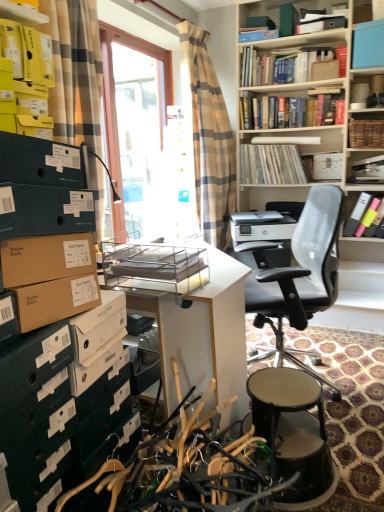
Question: From the image's perspective, is hardcover book at upper center, which is the 2th book from top to bottom, located above or below woven brown basket at upper right, the 1th shelf when ordered from top to bottom?

Choices:
 (A) above
 (B) below

Answer: (A)

Question: Relative to woven brown basket at upper right, the third shelf ordered from the bottom, is hardcover book at upper center, acting as the third book starting from the bottom, in front or behind?

Choices:
 (A) front
 (B) behind

Answer: (B)

Question: Estimate the real-world distances between objects in this image. Which object is closer to the blue plastic box at upper right?

Choices:
 (A) beige plaid curtain at left, positioned as the 2th curtain in right-to-left order
 (B) wooden vinyl records at upper center, acting as the 3th book starting from the top
 (C) beige plaid curtain at center, arranged as the 2th curtain when viewed from the front
 (D) hardcover book at upper center, which is the fourth book from bottom to top
 (E) white glossy desk at center

Answer: (D)

Question: Which is nearer to the woven brown basket at upper right, the third shelf ordered from the bottom?

Choices:
 (A) white glossy desk at center
 (B) blue plastic box at upper right
 (C) yellow cardboard boxes at upper left, positioned as the 3th shelf in right-to-left order
 (D) pastel matte highlighters at upper right, the 1th book positioned from the bottom
 (E) white mesh office chair at center

Answer: (B)